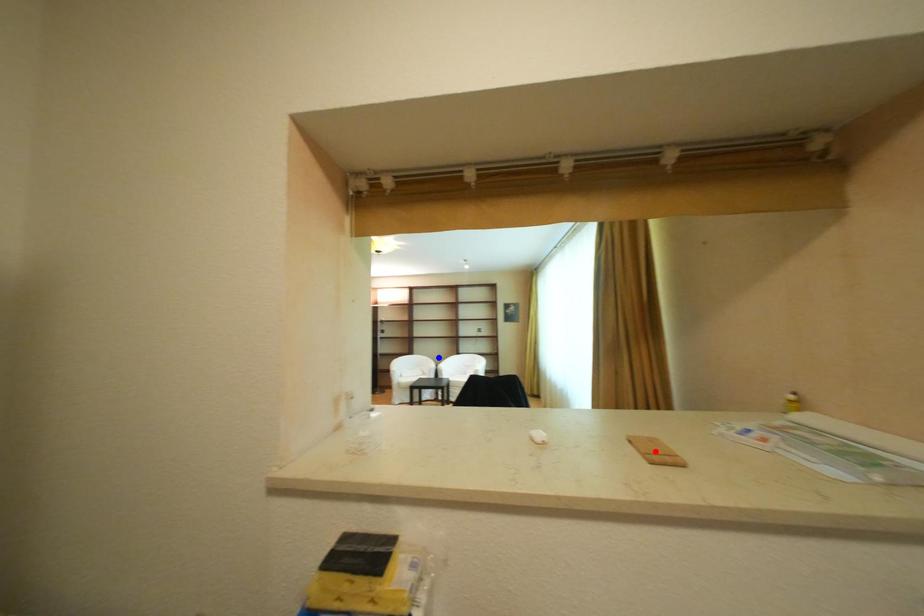
Question: In the image, two points are highlighted. Which point is nearer to the camera? Reply with the corresponding letter.

Choices:
 (A) blue point
 (B) red point

Answer: (B)